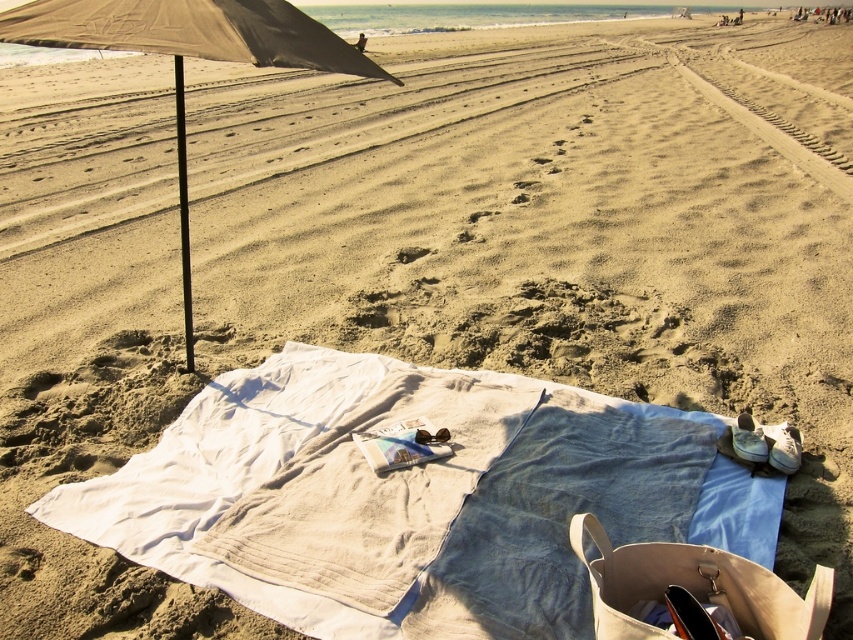
Question: Is white cotton towel at center below brown sand footprint at center?

Choices:
 (A) yes
 (B) no

Answer: (A)

Question: Which object appears closest to the camera in this image?

Choices:
 (A) brown sand footprint at center
 (B) white cotton towel at center

Answer: (B)

Question: Among these objects, which one is farthest from the camera?

Choices:
 (A) white cotton towel at center
 (B) beige fabric umbrella at left
 (C) brown sand footprint at center

Answer: (C)

Question: Is beige fabric umbrella at left to the right of brown sand footprint at center from the viewer's perspective?

Choices:
 (A) yes
 (B) no

Answer: (B)

Question: Can you confirm if white cotton towel at center is positioned to the left of brown sand footprint at center?

Choices:
 (A) no
 (B) yes

Answer: (A)

Question: Which is farther from the white cotton towel at center?

Choices:
 (A) beige fabric umbrella at left
 (B) brown sand footprint at center

Answer: (B)